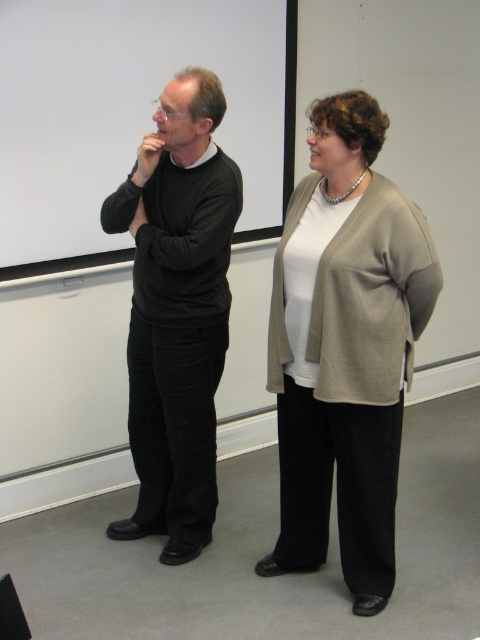
Question: Which object is positioned closest to the black ribbed sweater at left?

Choices:
 (A) white matte projection screen at upper center
 (B) beige sweater at center

Answer: (B)

Question: Which object is the farthest from the beige sweater at center?

Choices:
 (A) black ribbed sweater at left
 (B) white matte projection screen at upper center

Answer: (B)

Question: Is beige sweater at center to the left of white matte projection screen at upper center from the viewer's perspective?

Choices:
 (A) no
 (B) yes

Answer: (A)

Question: Does beige sweater at center have a lesser width compared to black ribbed sweater at left?

Choices:
 (A) no
 (B) yes

Answer: (A)

Question: Is white matte projection screen at upper center in front of black ribbed sweater at left?

Choices:
 (A) no
 (B) yes

Answer: (A)

Question: Which point appears farthest from the camera in this image?

Choices:
 (A) (196, 106)
 (B) (285, 552)
 (C) (36, 65)

Answer: (C)